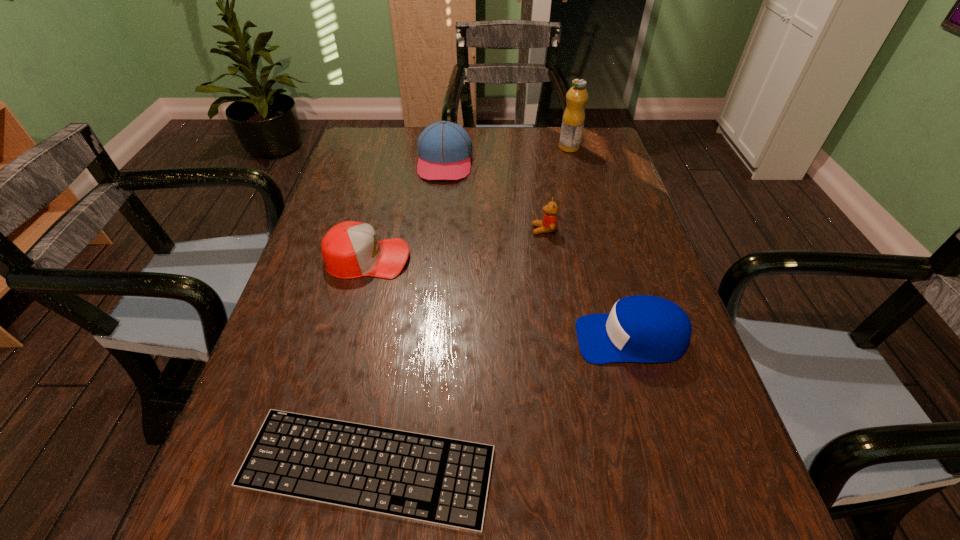
The width and height of the screenshot is (960, 540). I want to click on vacant space at the far edge of the desktop, so click(503, 159).

I want to click on vacant region at the left edge of the desktop, so click(x=313, y=314).

What are the coordinates of `free space at the right edge of the desktop` in the screenshot? It's located at (578, 188).

Where is `vacant area at the far left corner of the desktop`? This screenshot has width=960, height=540. vacant area at the far left corner of the desktop is located at coordinates (393, 160).

What are the coordinates of `unoccupied area between the fifth shortest object and the computer keyboard` in the screenshot? It's located at (406, 314).

Identify the location of vacant space that is in between the tallest object and the third object from right to left. The height and width of the screenshot is (540, 960). (557, 188).

I want to click on vacant space that is in between the fruit juice and the second nearest object, so click(600, 243).

Find the location of a particular element. This screenshot has width=960, height=540. vacant area that lies between the shortest object and the tallest baseball cap is located at coordinates (406, 314).

Where is `empty space that is in between the third object from right to left and the second nearest baseball cap`? The height and width of the screenshot is (540, 960). empty space that is in between the third object from right to left and the second nearest baseball cap is located at coordinates (456, 244).

Locate an element on the screen. This screenshot has width=960, height=540. vacant space that's between the second nearest baseball cap and the nearest baseball cap is located at coordinates (499, 299).